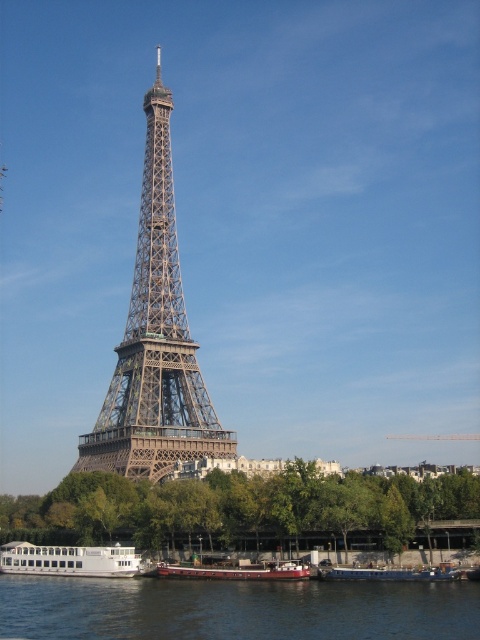
You are standing on the riverbank near the dark blue water at lower center and the red matte barge at lower center. You want to throw a small ball to a friend who is on the barge. If the ball can travel 10 meters, will it reach your friend?

The distance between the dark blue water at lower center and the red matte barge at lower center is 8.06 meters. Since the ball can travel 10 meters, it will easily reach your friend on the red matte barge at lower center.

You are standing at the Eiffel Tower and want to take a photo of a specific point in the scene. The point you want to capture is located at coordinates point (277, 616). If your camera has a depth sensor that can measure distances up to 300 feet, will you be able to capture the depth information for this point?

The distance of point (277, 616) from the camera is 306.18 feet, which exceeds the camera sensor limit of 300 feet. Therefore, the camera will not be able to capture depth information for this point.

You are a tourist standing at the Seine River bank and want to take a photo of the metallic structure at center and the white plastic boat at lower center. Which object should you focus on first if you want to capture both in the same frame without moving your camera?

Since the metallic structure at center is larger than the white plastic boat at lower center, you should focus on the metallic structure at center first to ensure it fits properly in the frame before adjusting for the smaller boat.